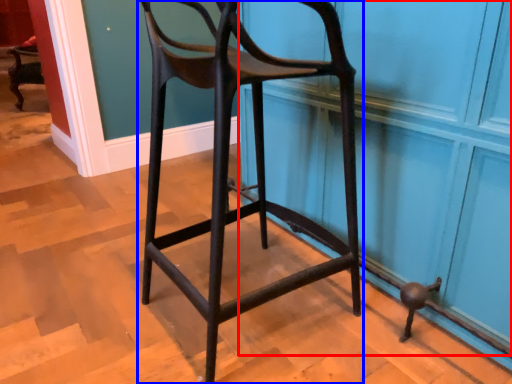
Question: Among these objects, which one is nearest to the camera, screen door (highlighted by a red box) or chair (highlighted by a blue box)?

Choices:
 (A) screen door
 (B) chair

Answer: (B)